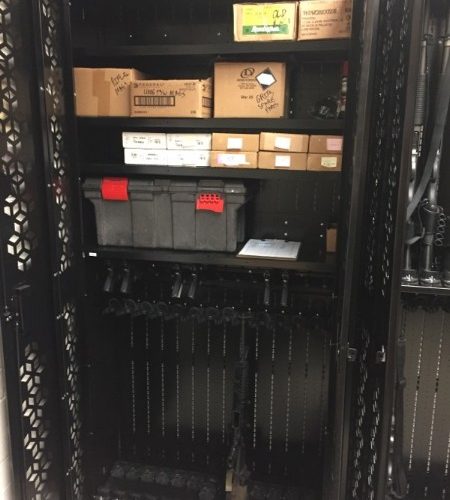
Find the location of a particular element. Image resolution: width=450 pixels, height=500 pixels. cardboard box is located at coordinates pos(233,89).